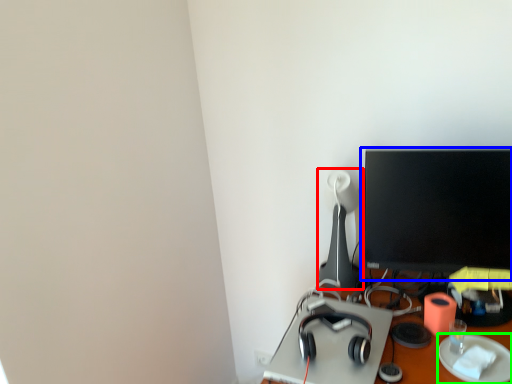
Question: Estimate the real-world distances between objects in this image. Which object is farther from table lamp (highlighted by a red box), computer monitor (highlighted by a blue box) or paper plate (highlighted by a green box)?

Choices:
 (A) computer monitor
 (B) paper plate

Answer: (B)